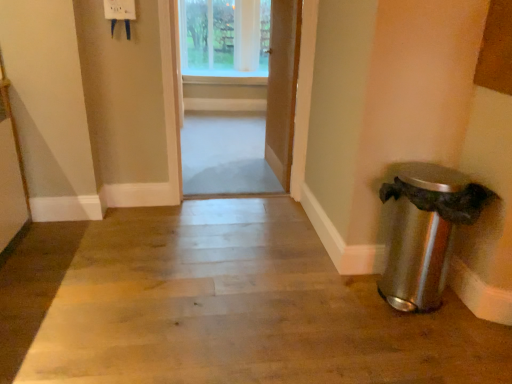
Question: From a real-world perspective, is wooden door at center, which ranks as the 2th door in right-to-left order, on top of clear glass window at upper center?

Choices:
 (A) yes
 (B) no

Answer: (B)

Question: Can you confirm if wooden door at center, the first door when ordered from left to right, is bigger than clear glass window at upper center?

Choices:
 (A) no
 (B) yes

Answer: (A)

Question: Considering the relative positions of wooden door at center, which ranks as the 2th door in right-to-left order, and clear glass window at upper center in the image provided, is wooden door at center, which ranks as the 2th door in right-to-left order, in front of clear glass window at upper center?

Choices:
 (A) yes
 (B) no

Answer: (A)

Question: From the image's perspective, would you say wooden door at center, the first door when ordered from left to right, is shown under clear glass window at upper center?

Choices:
 (A) yes
 (B) no

Answer: (A)

Question: Is wooden door at center, the first door when ordered from left to right, in contact with clear glass window at upper center?

Choices:
 (A) no
 (B) yes

Answer: (A)

Question: From a real-world perspective, is wooden door at center, which ranks as the 2th door in right-to-left order, above or below satin silver trash can at lower right?

Choices:
 (A) above
 (B) below

Answer: (A)

Question: Do you think wooden door at center, the first door when ordered from left to right, is within satin silver trash can at lower right, or outside of it?

Choices:
 (A) outside
 (B) inside

Answer: (A)

Question: Is wooden door at center, the first door when ordered from left to right, to the left or to the right of satin silver trash can at lower right in the image?

Choices:
 (A) left
 (B) right

Answer: (A)

Question: From the image's perspective, is wooden door at center, the first door when ordered from left to right, above or below satin silver trash can at lower right?

Choices:
 (A) below
 (B) above

Answer: (B)

Question: From a real-world perspective, is wooden door at center, the 2th door viewed from the left, positioned above or below wooden floor at center?

Choices:
 (A) above
 (B) below

Answer: (A)

Question: In the image, is wooden door at center, the 2th door viewed from the left, positioned in front of or behind wooden floor at center?

Choices:
 (A) behind
 (B) front

Answer: (A)

Question: Is point (289, 26) positioned closer to the camera than point (152, 347)?

Choices:
 (A) farther
 (B) closer

Answer: (A)

Question: Considering the positions of wooden door at center, the 2th door viewed from the left, and wooden floor at center in the image, is wooden door at center, the 2th door viewed from the left, wider or thinner than wooden floor at center?

Choices:
 (A) wide
 (B) thin

Answer: (B)

Question: Would you say wooden door at center, the 2th door viewed from the left, is to the left or to the right of wooden door at center, which ranks as the 2th door in right-to-left order, in the picture?

Choices:
 (A) right
 (B) left

Answer: (A)

Question: Is wooden door at center, the 2th door viewed from the left, inside the boundaries of wooden door at center, which ranks as the 2th door in right-to-left order, or outside?

Choices:
 (A) inside
 (B) outside

Answer: (B)